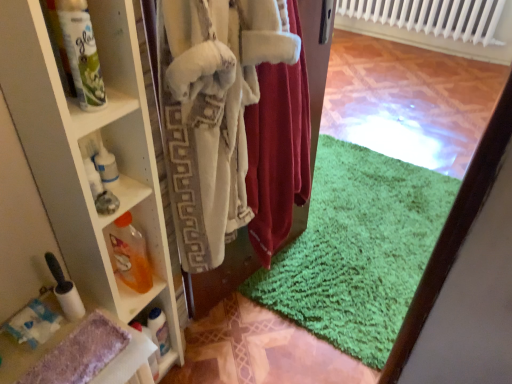
Question: Is translucent orange liquid at shelf left, the 2th bottle from the front, further to the viewer compared to white fuzzy robe at center, which appears as the 2th clothing when viewed from the right?

Choices:
 (A) yes
 (B) no

Answer: (A)

Question: Does translucent orange liquid at shelf left, placed as the 2th bottle when sorted from back to front, appear on the left side of white fuzzy robe at center, which appears as the 2th clothing when viewed from the right?

Choices:
 (A) no
 (B) yes

Answer: (B)

Question: Considering the relative sizes of translucent orange liquid at shelf left, the 2th bottle from the front, and white fuzzy robe at center, which appears as the 2th clothing when viewed from the right, in the image provided, is translucent orange liquid at shelf left, the 2th bottle from the front, shorter than white fuzzy robe at center, which appears as the 2th clothing when viewed from the right,?

Choices:
 (A) no
 (B) yes

Answer: (B)

Question: Considering the relative positions of translucent orange liquid at shelf left, the 2th bottle ordered from the bottom, and white fuzzy robe at center, which is the 1th clothing in left-to-right order, in the image provided, is translucent orange liquid at shelf left, the 2th bottle ordered from the bottom, to the right of white fuzzy robe at center, which is the 1th clothing in left-to-right order, from the viewer's perspective?

Choices:
 (A) no
 (B) yes

Answer: (A)

Question: Is translucent orange liquid at shelf left, placed as the 2th bottle when sorted from back to front, outside white fuzzy robe at center, which appears as the 2th clothing when viewed from the right?

Choices:
 (A) yes
 (B) no

Answer: (A)

Question: Considering the positions of point (163, 233) and point (258, 160), is point (163, 233) closer or farther from the camera than point (258, 160)?

Choices:
 (A) farther
 (B) closer

Answer: (B)

Question: In terms of width, does white glossy shelf at left look wider or thinner when compared to velvet red robe at center, which is counted as the first clothing, starting from the right?

Choices:
 (A) thin
 (B) wide

Answer: (A)

Question: Considering their positions, is white glossy shelf at left located in front of or behind velvet red robe at center, which ranks as the 2th clothing in left-to-right order?

Choices:
 (A) behind
 (B) front

Answer: (B)

Question: In the image, is white glossy shelf at left on the left side or the right side of velvet red robe at center, which ranks as the 2th clothing in left-to-right order?

Choices:
 (A) right
 (B) left

Answer: (B)

Question: From the image's perspective, relative to white glossy shelf at left, is white fuzzy robe at center, which appears as the 2th clothing when viewed from the right, above or below?

Choices:
 (A) above
 (B) below

Answer: (A)

Question: In terms of height, does white fuzzy robe at center, which is the 1th clothing in left-to-right order, look taller or shorter compared to white glossy shelf at left?

Choices:
 (A) short
 (B) tall

Answer: (A)

Question: Is point (184, 69) closer or farther from the camera than point (93, 261)?

Choices:
 (A) farther
 (B) closer

Answer: (B)

Question: Is white fuzzy robe at center, which appears as the 2th clothing when viewed from the right, situated inside white glossy shelf at left or outside?

Choices:
 (A) inside
 (B) outside

Answer: (B)

Question: Considering the positions of point (161, 352) and point (161, 18), is point (161, 352) closer or farther from the camera than point (161, 18)?

Choices:
 (A) closer
 (B) farther

Answer: (B)

Question: Considering the positions of white glossy bottle at lower left, the 1th bottle from the back, and white fuzzy robe at center, which appears as the 2th clothing when viewed from the right, in the image, is white glossy bottle at lower left, the 1th bottle from the back, bigger or smaller than white fuzzy robe at center, which appears as the 2th clothing when viewed from the right,?

Choices:
 (A) big
 (B) small

Answer: (B)